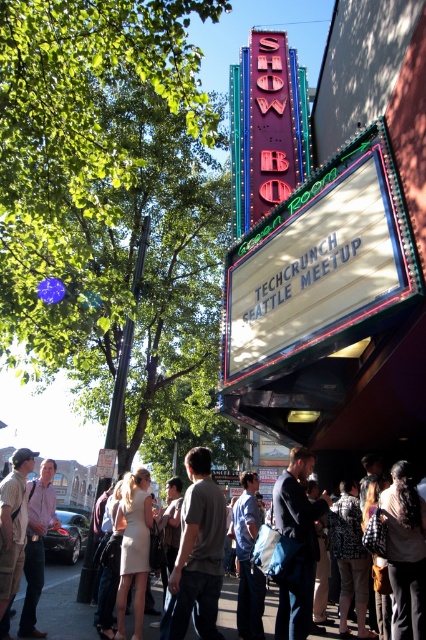
Question: Does dark blue shirt at center have a lesser width compared to light brown fabric crowd at lower center?

Choices:
 (A) no
 (B) yes

Answer: (B)

Question: Which of the following is the farthest from the observer?

Choices:
 (A) click(28, 582)
 (B) click(290, 589)
 (C) click(181, 630)
 (D) click(271, 589)

Answer: (D)

Question: Observing the image, what is the correct spatial positioning of gray cotton t-shirt at center in reference to dark blue shirt at center?

Choices:
 (A) right
 (B) left

Answer: (B)

Question: Estimate the real-world distances between objects in this image. Which object is farther from the light brown fabric crowd at lower center?

Choices:
 (A) dark blue shirt at center
 (B) blue denim jeans at center
 (C) light brown leather jacket at lower left
 (D) gray cotton t-shirt at center

Answer: (A)

Question: Which point is farther to the camera?

Choices:
 (A) blue denim jeans at center
 (B) gray cotton t-shirt at center

Answer: (A)

Question: Is gray cotton t-shirt at center wider than light brown fabric crowd at lower center?

Choices:
 (A) no
 (B) yes

Answer: (A)